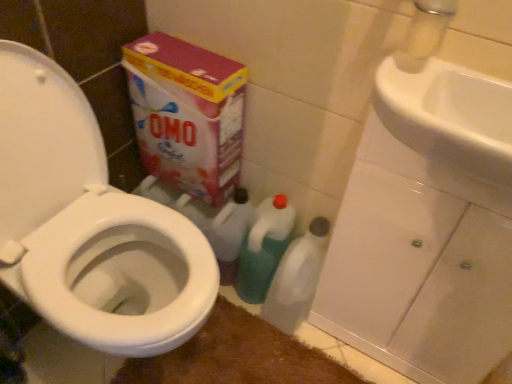
Question: Considering the relative positions of transparent plastic bottle at lower center, positioned as the 2th cleaning product in left-to-right order, and brown plush bath mat at lower center in the image provided, is transparent plastic bottle at lower center, positioned as the 2th cleaning product in left-to-right order, to the right of brown plush bath mat at lower center from the viewer's perspective?

Choices:
 (A) yes
 (B) no

Answer: (A)

Question: Does transparent plastic bottle at lower center, which appears as the 1th cleaning product when viewed from the right, lie in front of brown plush bath mat at lower center?

Choices:
 (A) no
 (B) yes

Answer: (A)

Question: From a real-world perspective, does transparent plastic bottle at lower center, which appears as the 1th cleaning product when viewed from the right, sit lower than brown plush bath mat at lower center?

Choices:
 (A) yes
 (B) no

Answer: (B)

Question: Does transparent plastic bottle at lower center, positioned as the 2th cleaning product in left-to-right order, have a greater height compared to brown plush bath mat at lower center?

Choices:
 (A) no
 (B) yes

Answer: (B)

Question: Is transparent plastic bottle at lower center, positioned as the 2th cleaning product in left-to-right order, directly adjacent to brown plush bath mat at lower center?

Choices:
 (A) no
 (B) yes

Answer: (A)

Question: From the image's perspective, relative to white glossy toilet at left, is transparent plastic bottle at lower center, positioned as the 2th cleaning product in left-to-right order, above or below?

Choices:
 (A) below
 (B) above

Answer: (A)

Question: Would you say transparent plastic bottle at lower center, positioned as the 2th cleaning product in left-to-right order, is inside or outside white glossy toilet at left?

Choices:
 (A) outside
 (B) inside

Answer: (A)

Question: In terms of size, does transparent plastic bottle at lower center, positioned as the 2th cleaning product in left-to-right order, appear bigger or smaller than white glossy toilet at left?

Choices:
 (A) small
 (B) big

Answer: (A)

Question: Is transparent plastic bottle at lower center, positioned as the 2th cleaning product in left-to-right order, taller or shorter than white glossy toilet at left?

Choices:
 (A) tall
 (B) short

Answer: (B)

Question: In terms of width, does metallic silver faucet at upper right look wider or thinner when compared to white glossy sink at upper right?

Choices:
 (A) thin
 (B) wide

Answer: (A)

Question: Considering the positions of point (441, 38) and point (420, 105), is point (441, 38) closer or farther from the camera than point (420, 105)?

Choices:
 (A) closer
 (B) farther

Answer: (B)

Question: Relative to white glossy sink at upper right, is metallic silver faucet at upper right in front or behind?

Choices:
 (A) behind
 (B) front

Answer: (A)

Question: In the image, is metallic silver faucet at upper right on the left side or the right side of white glossy sink at upper right?

Choices:
 (A) left
 (B) right

Answer: (A)

Question: Based on their sizes in the image, would you say transparent plastic bottle at lower center, positioned as the 2th cleaning product in left-to-right order, is bigger or smaller than metallic silver faucet at upper right?

Choices:
 (A) big
 (B) small

Answer: (A)

Question: From the image's perspective, is transparent plastic bottle at lower center, which appears as the 1th cleaning product when viewed from the right, positioned above or below metallic silver faucet at upper right?

Choices:
 (A) below
 (B) above

Answer: (A)